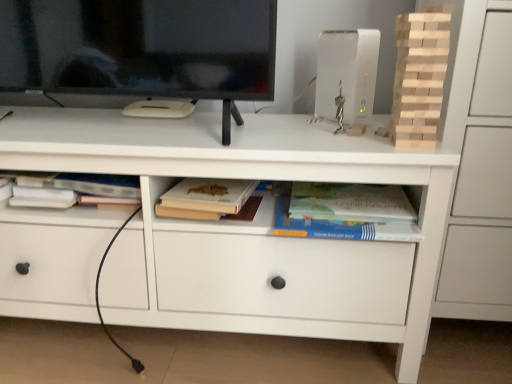
In order to click on vacant space underneath white matte chest of drawers at center (from a real-world perspective) in this screenshot , I will do pos(167,342).